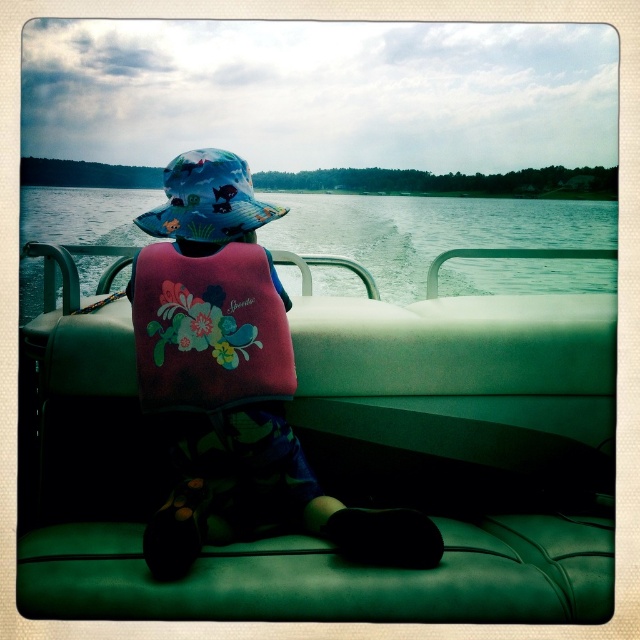
Is floral fleece life vest at center thinner than printed fabric sunhat at center?

No.

Where is `floral fleece life vest at center`? floral fleece life vest at center is located at coordinates (234, 381).

Does point (244, 339) come in front of point (195, 216)?

Yes, it is.

This screenshot has width=640, height=640. I want to click on floral fleece life vest at center, so click(x=234, y=381).

Is the position of floral fleece life vest at center less distant than that of floral fabric life jacket at center?

Yes, it is.

Is floral fleece life vest at center taller than floral fabric life jacket at center?

Indeed, floral fleece life vest at center has a greater height compared to floral fabric life jacket at center.

Does point (224, 481) come farther from viewer compared to point (241, 369)?

Yes.

Identify the location of floral fleece life vest at center. (234, 381).

I want to click on green water at center, so click(x=429, y=230).

Does point (291, 227) lie behind point (202, 184)?

That is True.

Is point (348, 212) positioned behind point (170, 196)?

Yes, it is behind point (170, 196).

Where is `green water at center`? The height and width of the screenshot is (640, 640). green water at center is located at coordinates (429, 230).